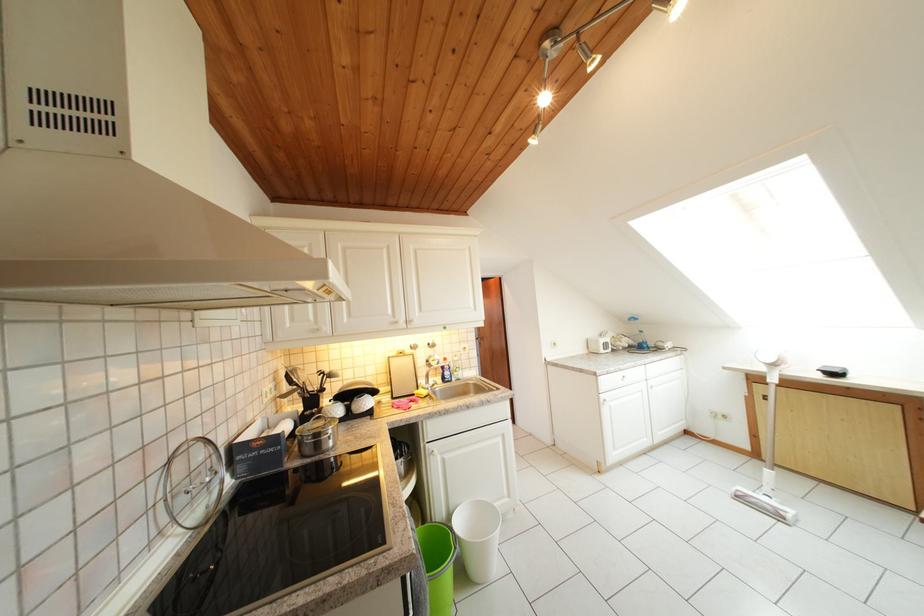
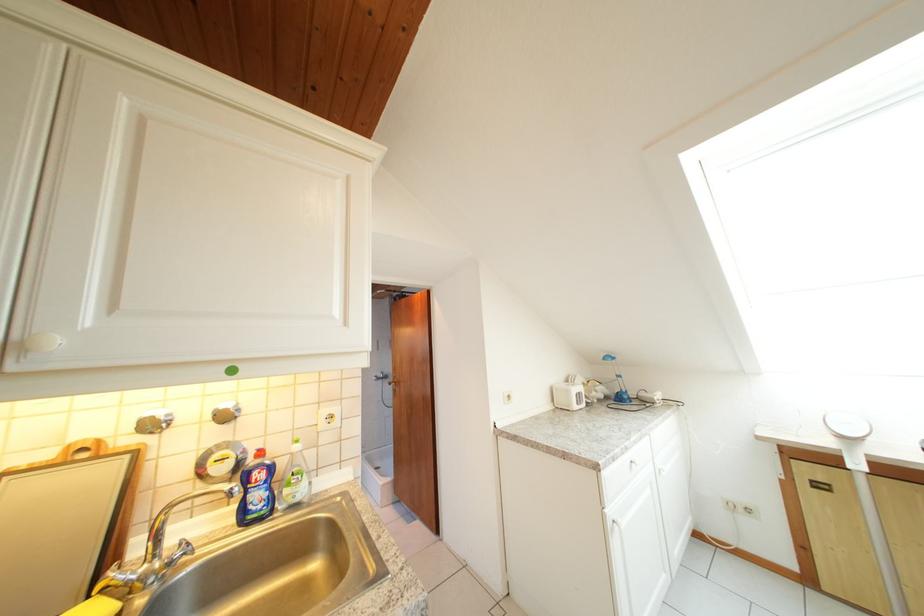
Where in the second image is the point corresponding to [639,347] from the first image?

(614, 397)